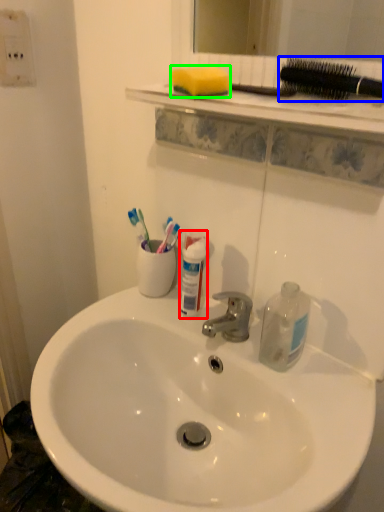
Question: Estimate the real-world distances between objects in this image. Which object is closer to toiletry (highlighted by a red box), brush (highlighted by a blue box) or soap (highlighted by a green box)?

Choices:
 (A) brush
 (B) soap

Answer: (B)